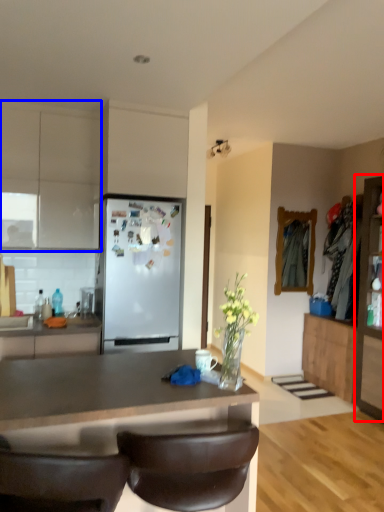
Question: Which object is further to the camera taking this photo, cabinetry (highlighted by a red box) or cabinetry (highlighted by a blue box)?

Choices:
 (A) cabinetry
 (B) cabinetry

Answer: (A)